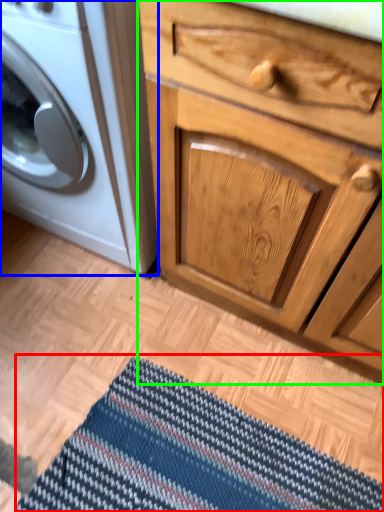
Question: Which object is positioned farthest from doormat (highlighted by a red box)? Select from washing machine (highlighted by a blue box) and chest of drawers (highlighted by a green box).

Choices:
 (A) washing machine
 (B) chest of drawers

Answer: (A)